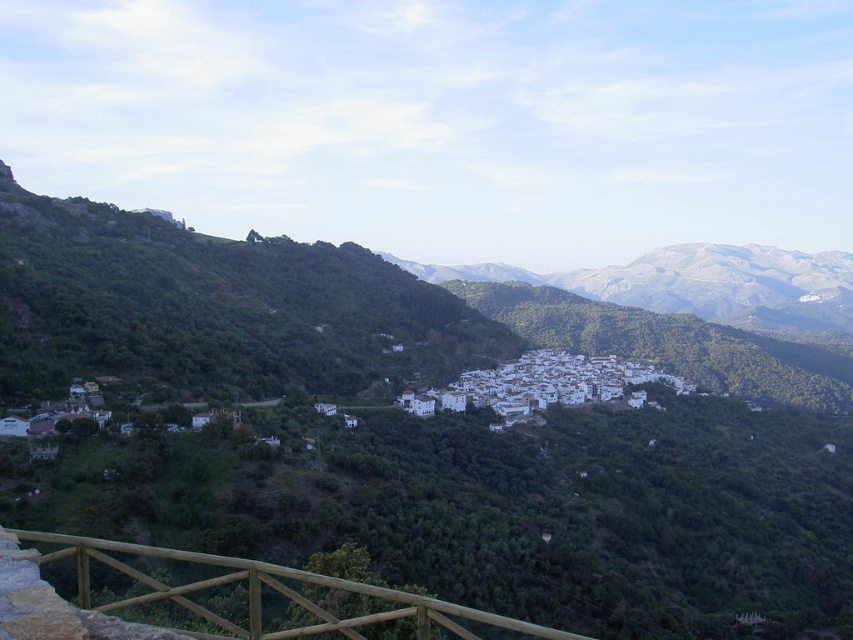
Question: Estimate the real-world distances between objects in this image. Which object is farther from the green leafy hillside at center?

Choices:
 (A) brown wooden rail at lower left
 (B) white matte village at center

Answer: (A)

Question: Which of the following is the farthest from the observer?

Choices:
 (A) (515, 378)
 (B) (231, 564)

Answer: (A)

Question: Is green leafy hillside at center to the left of white matte village at center from the viewer's perspective?

Choices:
 (A) no
 (B) yes

Answer: (B)

Question: Does green leafy hillside at center lie in front of white matte village at center?

Choices:
 (A) yes
 (B) no

Answer: (A)

Question: Which point is farther from the camera taking this photo?

Choices:
 (A) (556, 381)
 (B) (482, 612)

Answer: (A)

Question: Can you confirm if brown wooden rail at lower left is thinner than white matte village at center?

Choices:
 (A) yes
 (B) no

Answer: (A)